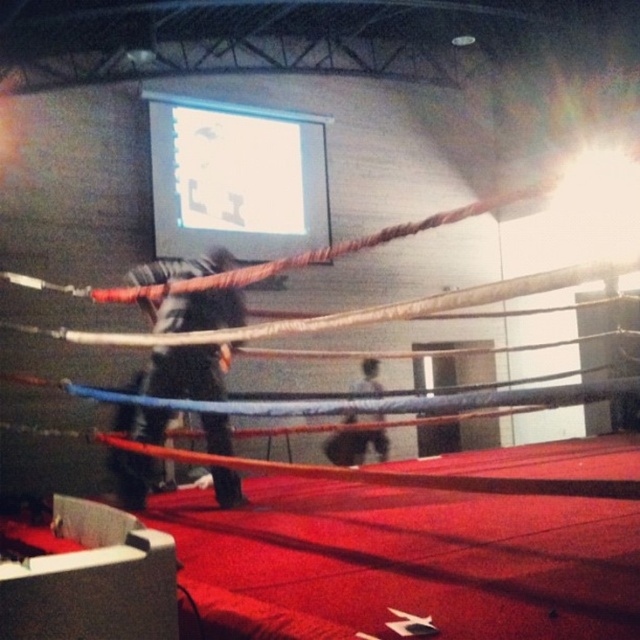
From the picture: You are a boxer standing at the center of the ring. You notice two points marked on the floor. The first point is at coordinate point (150, 184) and the second point is at coordinate point (355, 392). Which point is closer to you?

Point (150, 184) is in front of point (355, 392), so the first point is closer to you.

You are a photographer setting up equipment in the boxing ring. You need to place a tripod between the white glossy projection screen at upper center and the black matte pants at center. Based on their positions, which object should the tripod be placed closer to?

The white glossy projection screen at upper center is positioned over the black matte pants at center, so the tripod should be placed closer to the black matte pants at center since it is lower and the screen is above it.

You are a photographer setting up equipment in the boxing ring. You have a camera that can only focus on objects within 3 meters. The white glossy projection screen at upper center and the black matte pants at center are both in your view. Which object is closer to your camera?

The black matte pants at center are closer to the camera because the white glossy projection screen at upper center is larger in size, and larger objects appear closer when they are actually farther away due to perspective.